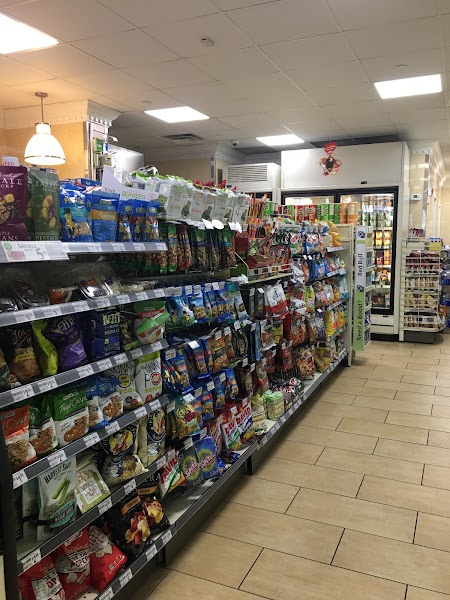
In order to click on glass door in this screenshot , I will do `click(378, 217)`, `click(325, 199)`.